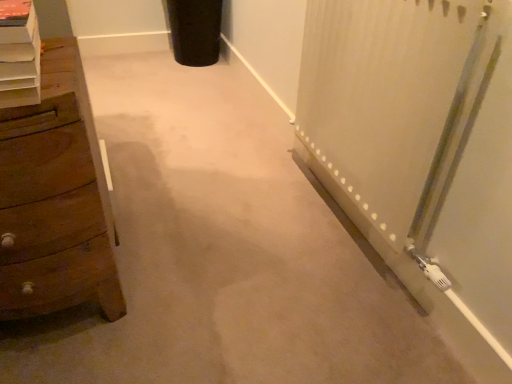
The height and width of the screenshot is (384, 512). Describe the element at coordinates (55, 199) in the screenshot. I see `wooden chest of drawers at left` at that location.

This screenshot has height=384, width=512. Find the location of `wooden chest of drawers at left`. wooden chest of drawers at left is located at coordinates (55, 199).

Identify the location of white wooden shelf at left. (19, 54).

This screenshot has width=512, height=384. What do you see at coordinates (19, 54) in the screenshot?
I see `white wooden shelf at left` at bounding box center [19, 54].

I want to click on wooden chest of drawers at left, so click(x=55, y=199).

From the picture: Considering the positions of objects white wooden shelf at left and wooden chest of drawers at left in the image provided, who is more to the left, white wooden shelf at left or wooden chest of drawers at left?

wooden chest of drawers at left is more to the left.

Between white wooden shelf at left and wooden chest of drawers at left, which one is positioned behind?

wooden chest of drawers at left is behind.

Which is behind, point (34, 18) or point (18, 174)?

Positioned behind is point (18, 174).

Consider the image. From the image's perspective, is white wooden shelf at left above or below wooden chest of drawers at left?

white wooden shelf at left is situated higher than wooden chest of drawers at left in the image.

From a real-world perspective, is white wooden shelf at left positioned above or below wooden chest of drawers at left?

In terms of real-world spatial position, white wooden shelf at left is above wooden chest of drawers at left.

Does white wooden shelf at left have a greater width compared to wooden chest of drawers at left?

In fact, white wooden shelf at left might be narrower than wooden chest of drawers at left.

Is white wooden shelf at left shorter than wooden chest of drawers at left?

Indeed, white wooden shelf at left has a lesser height compared to wooden chest of drawers at left.

Considering the relative sizes of white wooden shelf at left and wooden chest of drawers at left in the image provided, is white wooden shelf at left smaller than wooden chest of drawers at left?

Indeed, white wooden shelf at left has a smaller size compared to wooden chest of drawers at left.

Is white wooden shelf at left inside or outside of wooden chest of drawers at left?

The correct answer is: outside.

Is white wooden shelf at left far from wooden chest of drawers at left?

No, there isn't a large distance between white wooden shelf at left and wooden chest of drawers at left.

Is wooden chest of drawers at left at the back of white wooden shelf at left?

No.

What are the coordinates of `shelf that is in front of the wooden chest of drawers at left` in the screenshot? It's located at (19, 54).

Based on their positions, is wooden chest of drawers at left located to the left or right of white wooden shelf at left?

From the image, it's evident that wooden chest of drawers at left is to the left of white wooden shelf at left.

Which is behind, wooden chest of drawers at left or white wooden shelf at left?

wooden chest of drawers at left is further away from the camera.

Is point (65, 89) more distant than point (26, 93)?

That is True.

From the image's perspective, which is below, wooden chest of drawers at left or white wooden shelf at left?

wooden chest of drawers at left.

From a real-world perspective, which is physically below, wooden chest of drawers at left or white wooden shelf at left?

From a 3D spatial view, wooden chest of drawers at left is below.

Considering the sizes of objects wooden chest of drawers at left and white wooden shelf at left in the image provided, who is thinner, wooden chest of drawers at left or white wooden shelf at left?

With smaller width is white wooden shelf at left.

Is wooden chest of drawers at left shorter than white wooden shelf at left?

No.

From the picture: Can you confirm if wooden chest of drawers at left is bigger than white wooden shelf at left?

Yes, wooden chest of drawers at left is bigger than white wooden shelf at left.

Does wooden chest of drawers at left contain white wooden shelf at left?

No.

Consider the image. Is wooden chest of drawers at left touching white wooden shelf at left?

No.

Is wooden chest of drawers at left aimed at white wooden shelf at left?

No, wooden chest of drawers at left is not oriented towards white wooden shelf at left.

Locate an element on the screen. Image resolution: width=512 pixels, height=384 pixels. shelf above the wooden chest of drawers at left (from the image's perspective) is located at coordinates (19, 54).

In order to click on the chest of drawers that appears below the white wooden shelf at left (from the image's perspective) in this screenshot , I will do `click(55, 199)`.

This screenshot has height=384, width=512. Find the location of `shelf located above the wooden chest of drawers at left (from a real-world perspective)`. shelf located above the wooden chest of drawers at left (from a real-world perspective) is located at coordinates (19, 54).